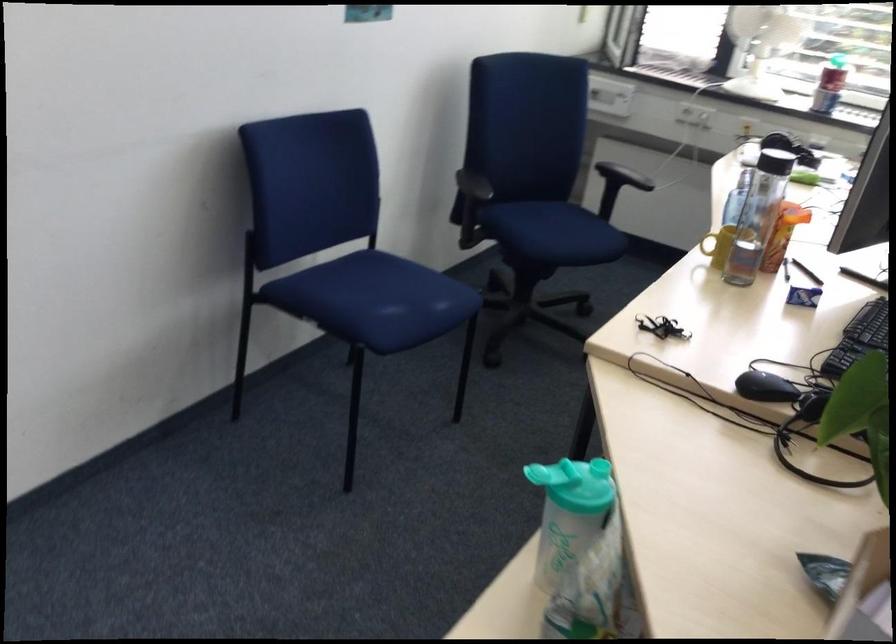
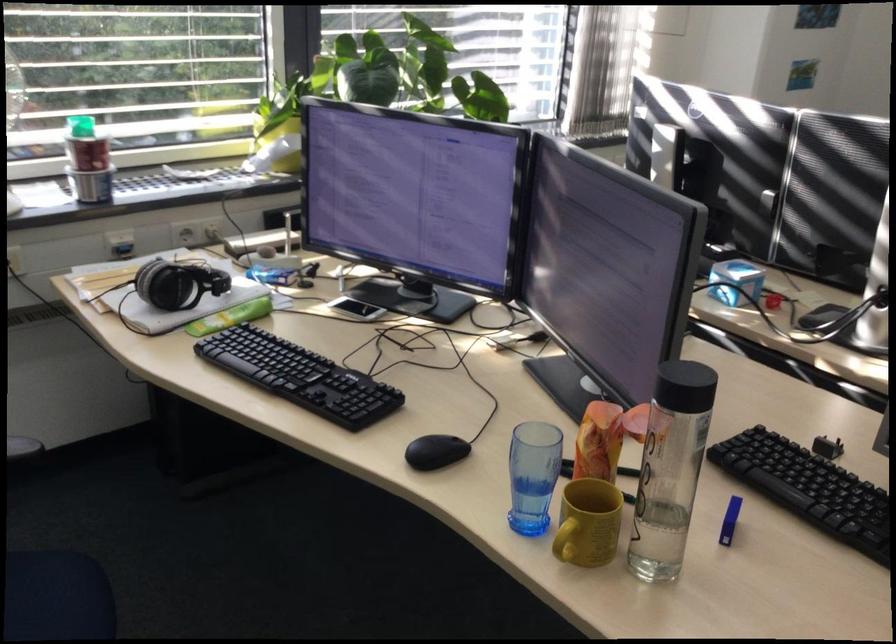
In the second image, find the point that corresponds to the point at 800,290 in the first image.

(729, 520)